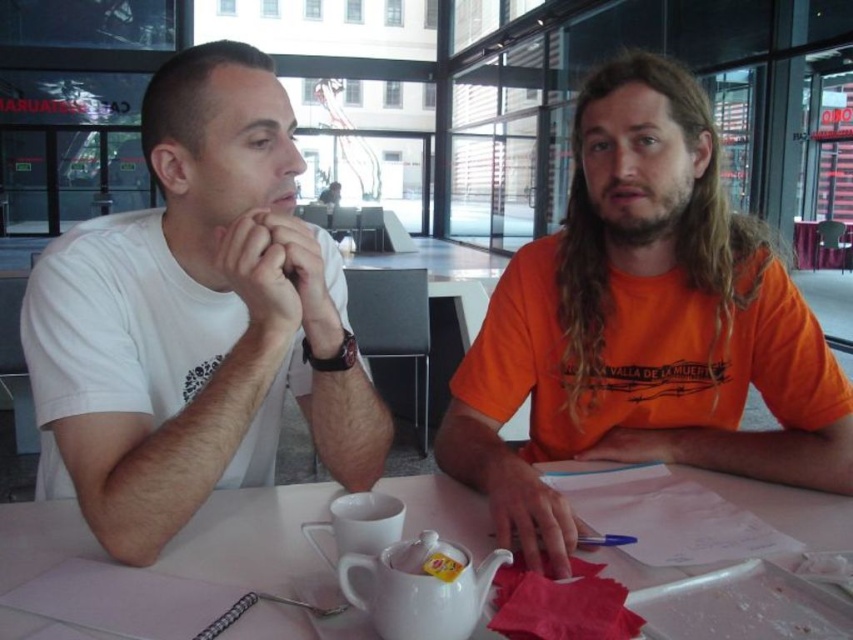
Question: Can you confirm if orange cotton shirt at center is bigger than white glossy tea pot at center?

Choices:
 (A) no
 (B) yes

Answer: (B)

Question: In this image, where is white cotton t-shirt at left located relative to white glossy table at center?

Choices:
 (A) right
 (B) left

Answer: (B)

Question: From the image, what is the correct spatial relationship of orange cotton shirt at center in relation to white glossy table at center?

Choices:
 (A) above
 (B) below

Answer: (A)

Question: Which object is farther from the camera taking this photo?

Choices:
 (A) white cotton t-shirt at left
 (B) white glossy table at center
 (C) orange cotton shirt at center

Answer: (A)

Question: Which point appears farthest from the camera in this image?

Choices:
 (A) (419, 600)
 (B) (195, 556)
 (C) (598, 252)
 (D) (84, 305)

Answer: (C)

Question: Which is farther from the white glossy table at center?

Choices:
 (A) white glossy tea pot at center
 (B) orange cotton shirt at center

Answer: (B)